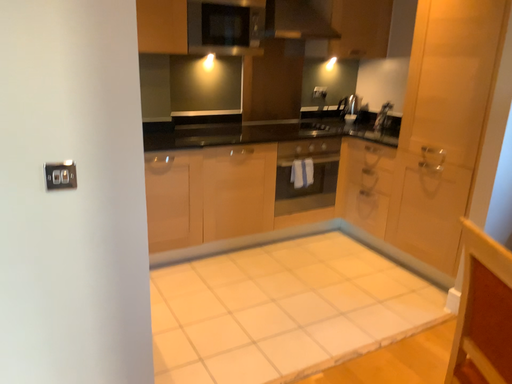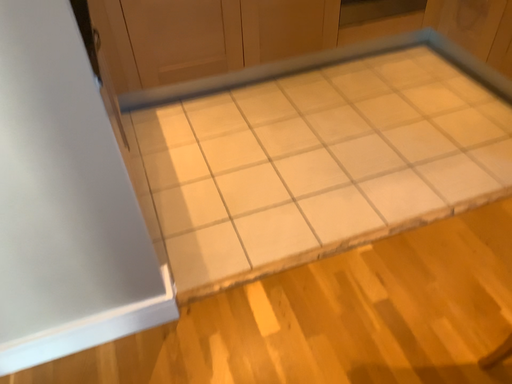
Question: Which way did the camera rotate in the video?

Choices:
 (A) rotated upward
 (B) rotated downward

Answer: (B)